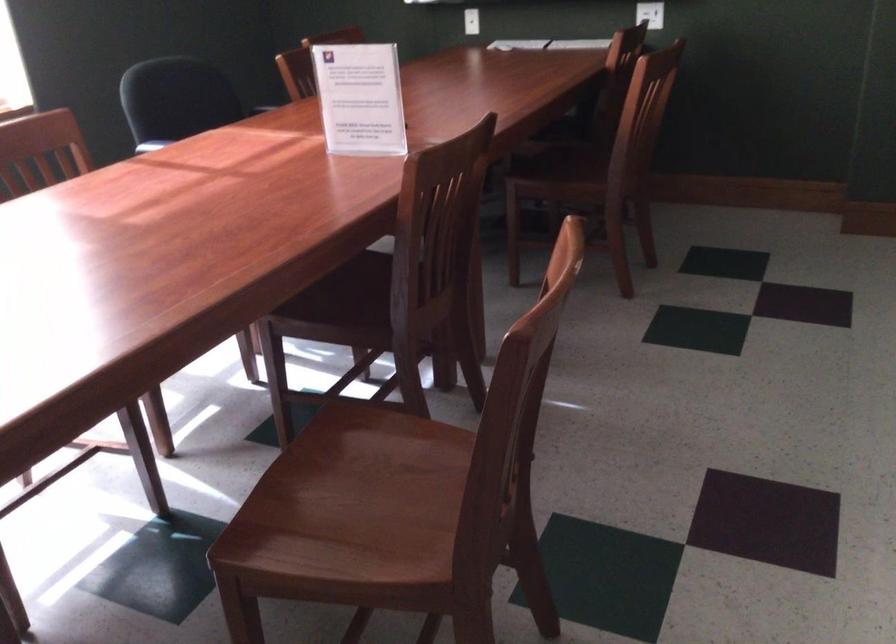
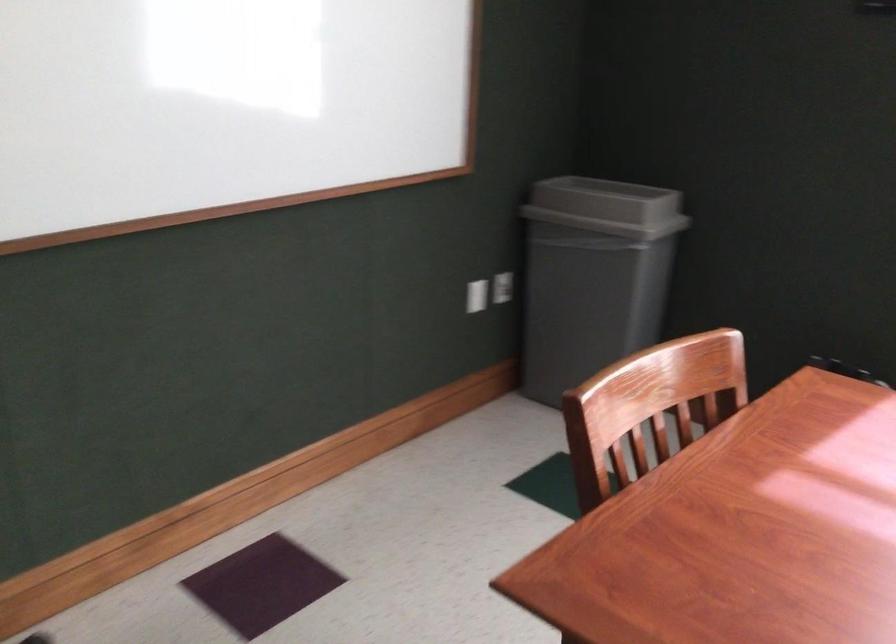
Based on the continuous images, in which direction is the camera rotating?

The camera's rotation is toward left-down.